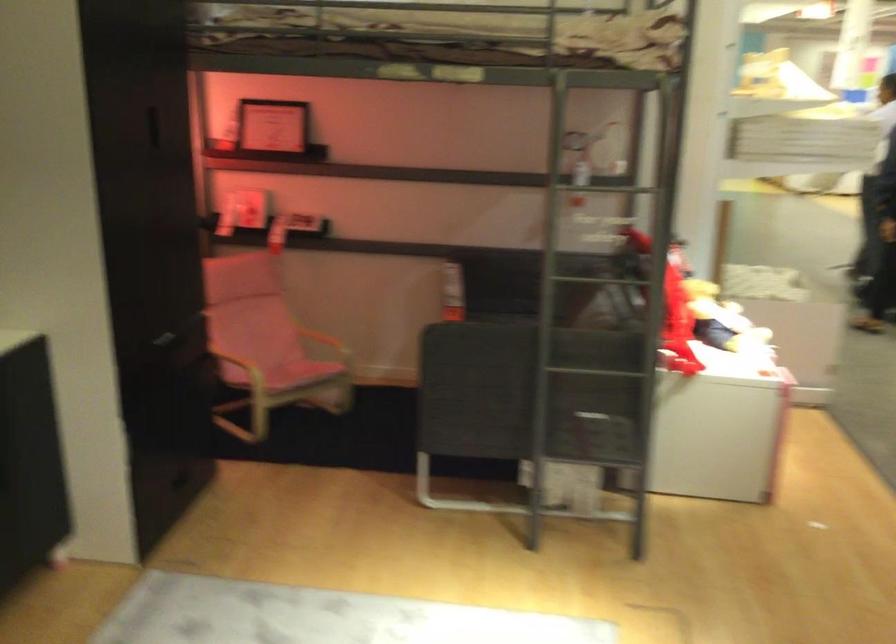
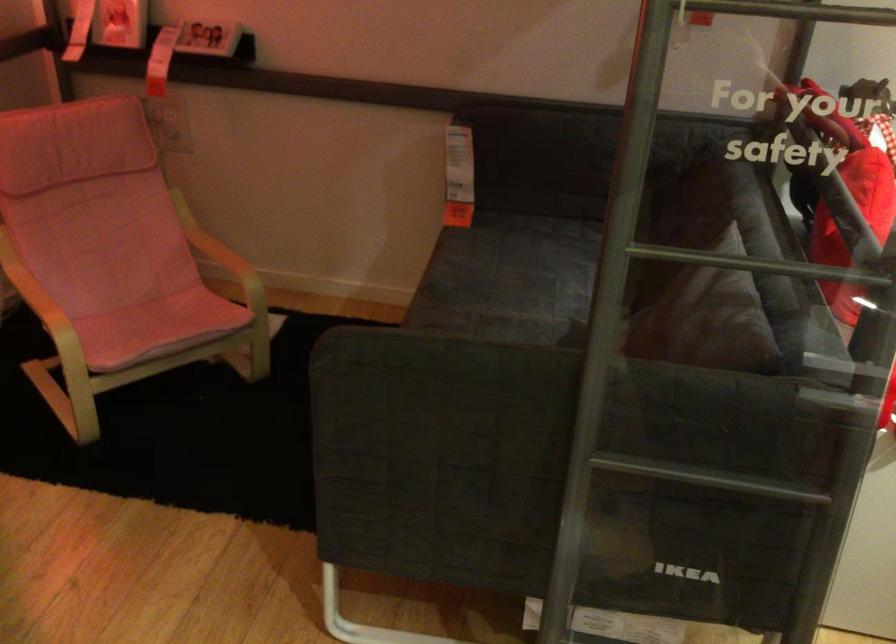
The point at (x=624, y=375) is marked in the first image. Where is the corresponding point in the second image?

(736, 484)